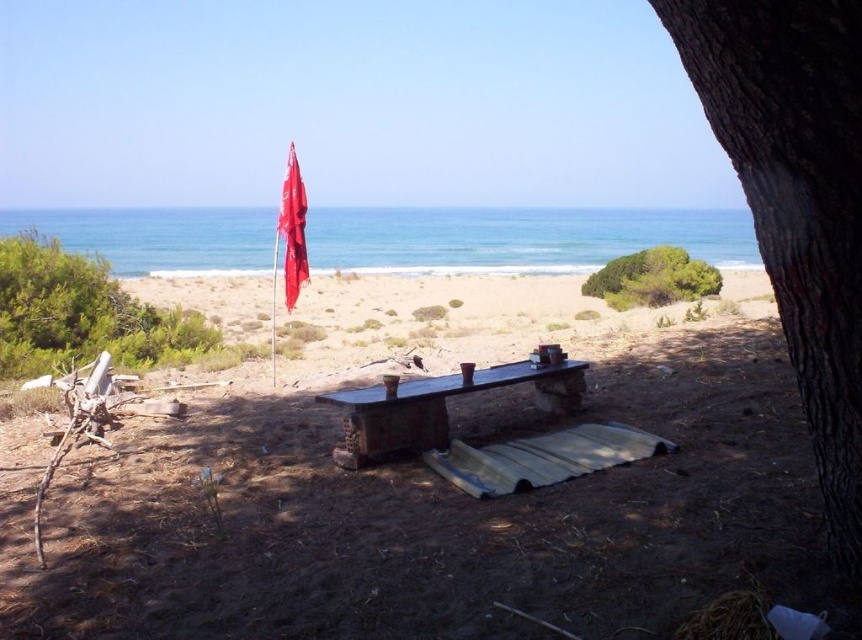
Can you confirm if brown dirt at center is positioned above brown rough bark tree at right?

Actually, brown dirt at center is below brown rough bark tree at right.

Is brown dirt at center shorter than brown rough bark tree at right?

Correct, brown dirt at center is not as tall as brown rough bark tree at right.

Where is `brown dirt at center`? Image resolution: width=862 pixels, height=640 pixels. brown dirt at center is located at coordinates (428, 516).

Image resolution: width=862 pixels, height=640 pixels. In order to click on brown dirt at center in this screenshot , I will do `click(428, 516)`.

Does point (859, 467) come in front of point (304, 250)?

Yes, point (859, 467) is in front of point (304, 250).

Which is below, brown rough bark tree at right or red fabric flag at upper center?

Positioned lower is brown rough bark tree at right.

Is point (857, 465) positioned behind point (297, 262)?

No, it is not.

Find the location of a particular element. brown rough bark tree at right is located at coordinates (797, 202).

Which of these two, brown dirt at center or green leafy bush at center, stands shorter?

With less height is brown dirt at center.

Does brown dirt at center appear over green leafy bush at center?

No, brown dirt at center is not above green leafy bush at center.

Locate an element on the screen. The height and width of the screenshot is (640, 862). brown dirt at center is located at coordinates (428, 516).

Locate an element on the screen. Image resolution: width=862 pixels, height=640 pixels. brown dirt at center is located at coordinates (428, 516).